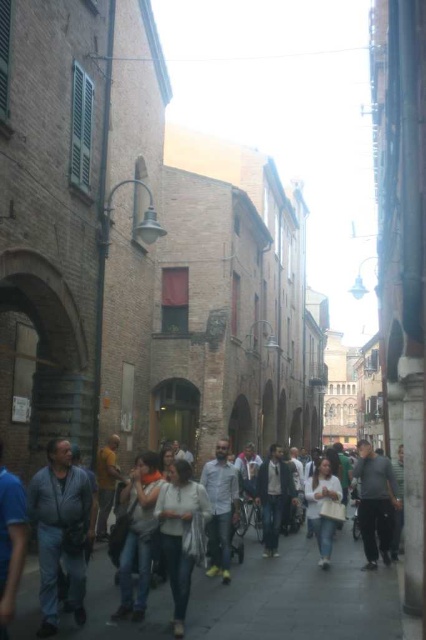
Is paved stone sidewalk at center positioned behind denim jeans at center?

No, paved stone sidewalk at center is in front of denim jeans at center.

Between paved stone sidewalk at center and denim jeans at center, which one has less height?

Standing shorter between the two is paved stone sidewalk at center.

Is point (190, 605) more distant than point (331, 480)?

No, (190, 605) is in front of (331, 480).

I want to click on paved stone sidewalk at center, so click(296, 596).

Consider the image. How distant is paved stone sidewalk at center from matte gray scarf at center?

They are 8.32 meters apart.

Does paved stone sidewalk at center appear over matte gray scarf at center?

No.

Who is more forward, (268,637) or (137,548)?

Point (268,637) is in front.

This screenshot has width=426, height=640. I want to click on paved stone sidewalk at center, so click(296, 596).

I want to click on matte gray scarf at center, so click(x=138, y=536).